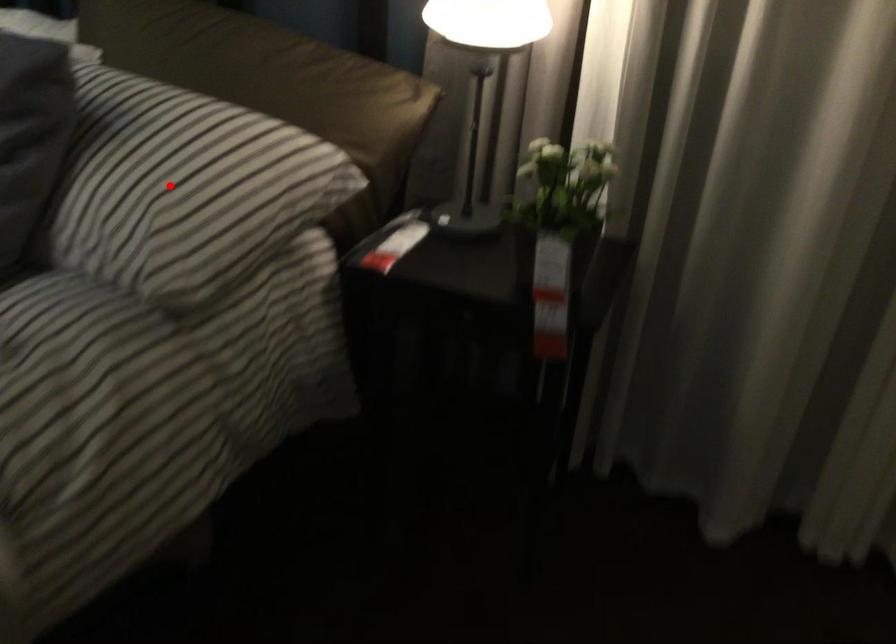
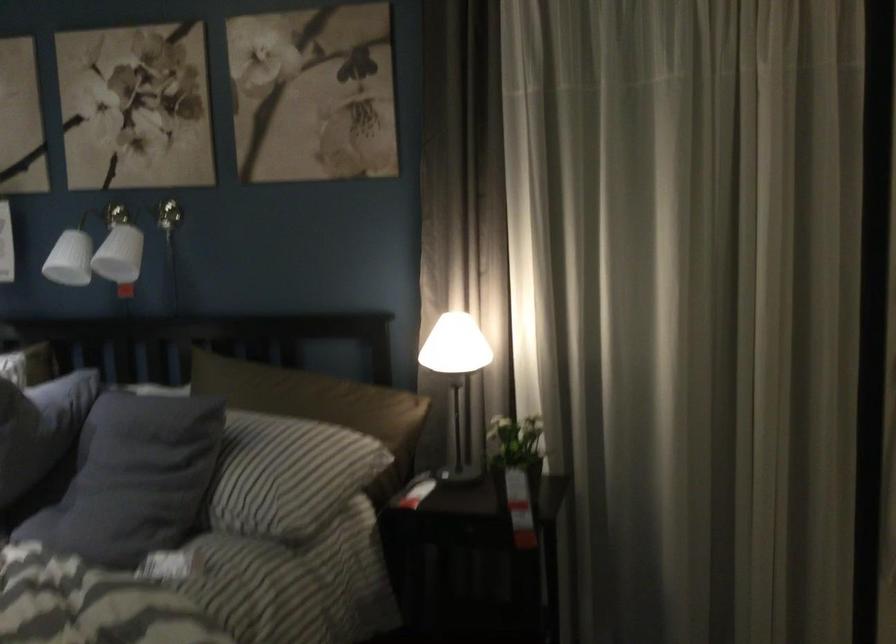
Locate, in the second image, the point that corresponds to the highlighted location in the first image.

(280, 471)